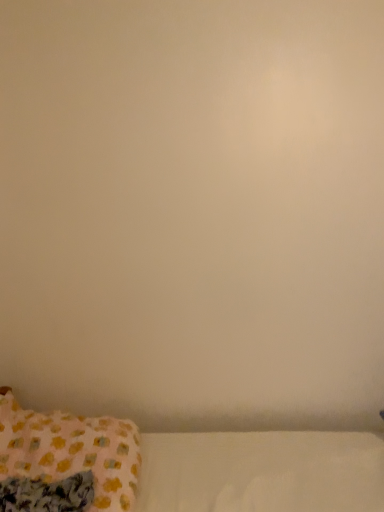
Measure the distance between pink fabric pillow at lower left and camera.

3.67 feet.

Measure the distance between point (105,430) and camera.

Point (105,430) is 1.50 meters away from camera.

What do you see at coordinates (65, 461) in the screenshot? This screenshot has height=512, width=384. I see `pink fabric pillow at lower left` at bounding box center [65, 461].

At what (x,y) coordinates should I click in order to perform the action: click on pink fabric pillow at lower left. Please return your answer as a coordinate pair (x, y). The width and height of the screenshot is (384, 512). Looking at the image, I should click on (65, 461).

The image size is (384, 512). Identify the location of pink fabric pillow at lower left. tap(65, 461).